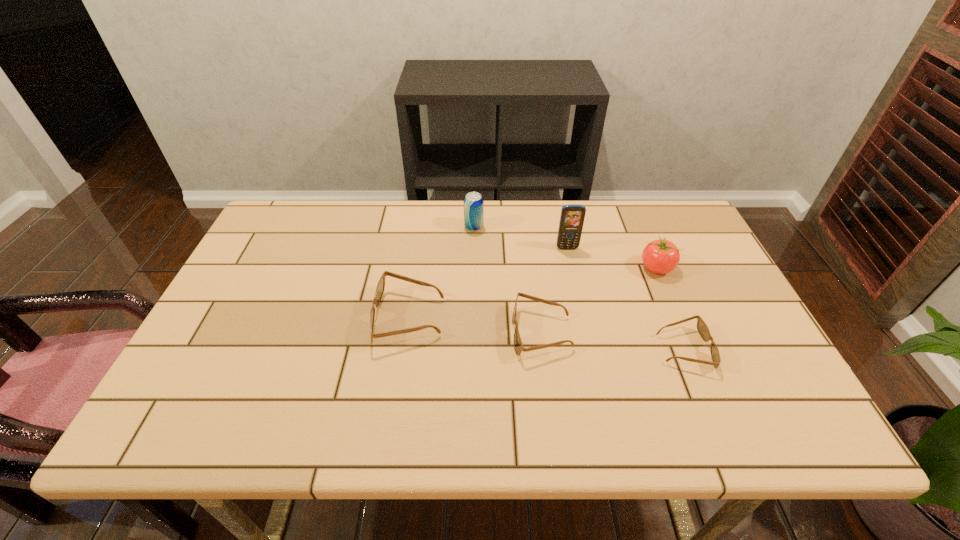
The image size is (960, 540). Find the location of `the leftmost sunglasses`. the leftmost sunglasses is located at coordinates (380, 287).

Where is `the tallest sunglasses`? This screenshot has height=540, width=960. the tallest sunglasses is located at coordinates (380, 287).

Where is `the second shortest object`? This screenshot has width=960, height=540. the second shortest object is located at coordinates (518, 345).

Locate an element on the screen. the fourth object from right to left is located at coordinates (518, 345).

You are a GUI agent. You are given a task and a screenshot of the screen. Output one action in this format:
    pyautogui.click(x=<x>, y=<y>)
    Task: Click on the shortest sunglasses
    
    Given the screenshot: What is the action you would take?
    pyautogui.click(x=702, y=328)

In order to click on the shortest object in this screenshot , I will do `click(702, 328)`.

Where is `the second tallest object`? the second tallest object is located at coordinates (473, 202).

You are a GUI agent. You are given a task and a screenshot of the screen. Output one action in this format:
    pyautogui.click(x=<x>, y=<y>)
    Task: Click on the fifth object from right to left
    Image resolution: width=960 pixels, height=540 pixels.
    Given the screenshot: What is the action you would take?
    pyautogui.click(x=473, y=202)

Image resolution: width=960 pixels, height=540 pixels. Find the location of `the second farthest object`. the second farthest object is located at coordinates (572, 216).

Locate an element on the screen. The image size is (960, 540). cellular telephone is located at coordinates (572, 216).